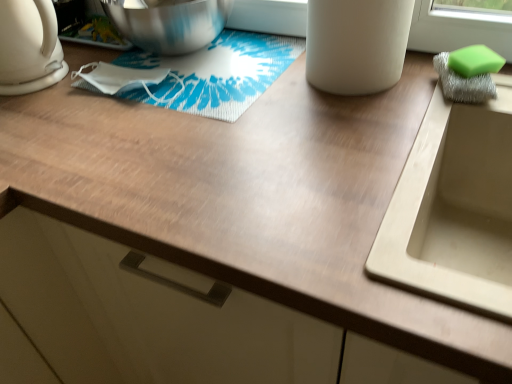
Question: From the image's perspective, is green sponge at right located above or below white matte cup at upper center?

Choices:
 (A) below
 (B) above

Answer: (A)

Question: In terms of height, does green sponge at right look taller or shorter compared to white matte cup at upper center?

Choices:
 (A) tall
 (B) short

Answer: (B)

Question: Considering the real-world distances, which object is closest to the shiny metallic mixing bowl at upper left?

Choices:
 (A) green sponge at right
 (B) white glossy kettle at left
 (C) beige matte sink at right
 (D) white matte cup at upper center

Answer: (B)

Question: Which object is positioned farthest from the shiny metallic mixing bowl at upper left?

Choices:
 (A) beige matte sink at right
 (B) white matte cup at upper center
 (C) green sponge at right
 (D) white glossy kettle at left

Answer: (A)